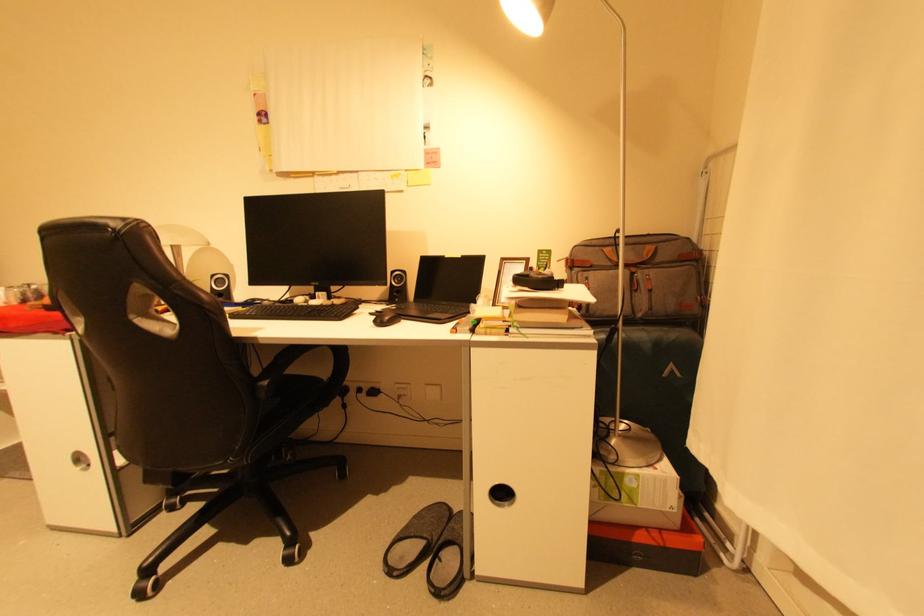
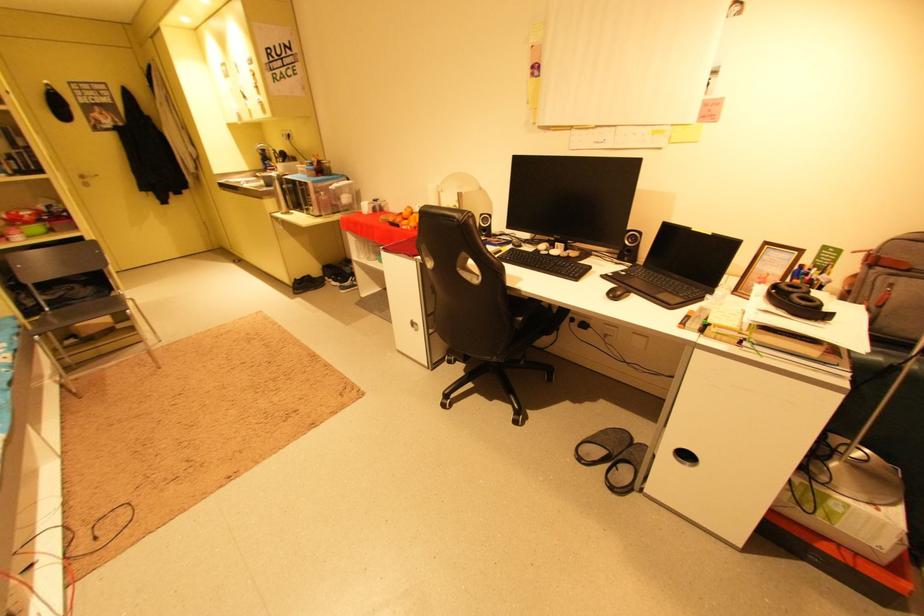
Where in the second image is the point corresponding to point 599,268 from the first image?

(917, 272)